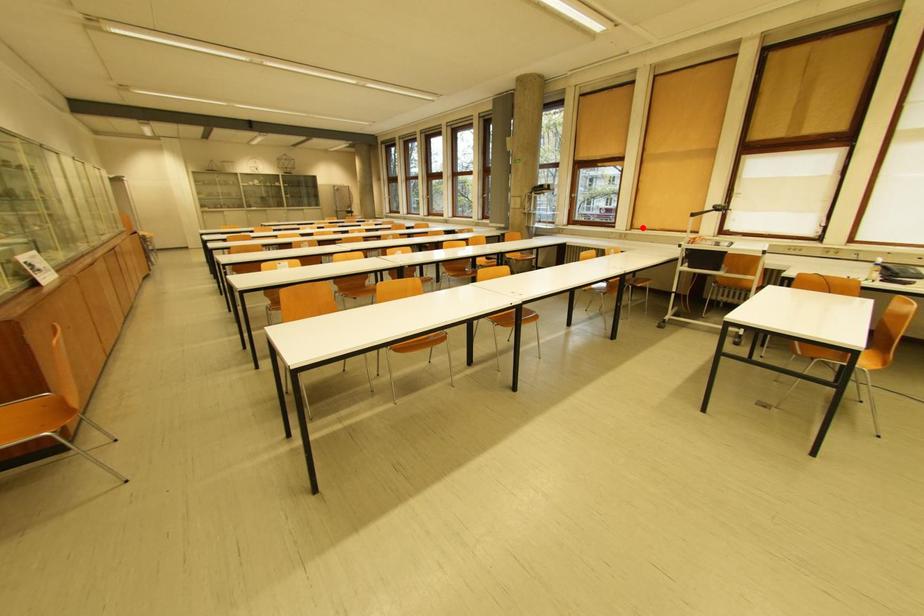
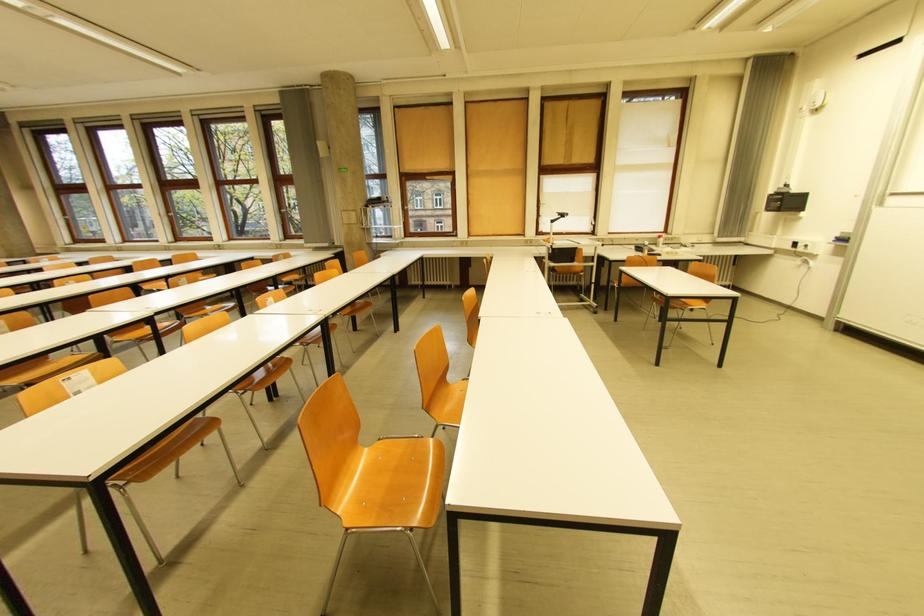
The point at the highlighted location is marked in the first image. Where is the corresponding point in the second image?

(479, 235)